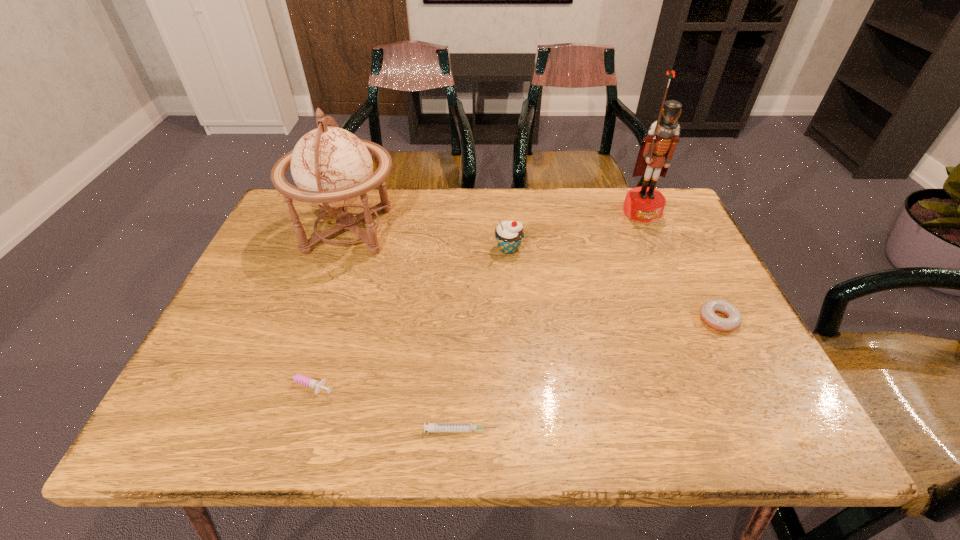
Identify the location of empty space that is in between the left syringe and the fourth farthest object. (511, 352).

This screenshot has height=540, width=960. I want to click on empty space between the fifth farthest object and the nutcracker, so click(x=472, y=298).

I want to click on object that is the second nearest to the fourth shortest object, so click(645, 204).

Identify the location of object that stands as the fifth closest to the nutcracker. (309, 382).

At what (x,y) coordinates should I click in order to perform the action: click on free spot that satisfies the following two spatial constraints: 1. at the front of the second tallest object showing Africa; 2. on the left side of the farther syringe. Please return your answer as a coordinate pair (x, y). The width and height of the screenshot is (960, 540). Looking at the image, I should click on (296, 385).

At what (x,y) coordinates should I click in order to perform the action: click on vacant point that satisfies the following two spatial constraints: 1. on the back side of the left syringe; 2. at the front of the globe showing Africa. Please return your answer as a coordinate pair (x, y). Looking at the image, I should click on (354, 231).

Find the location of `free space that satisfies the following two spatial constraints: 1. on the back side of the third nearest object; 2. at the front of the globe showing Africa`. free space that satisfies the following two spatial constraints: 1. on the back side of the third nearest object; 2. at the front of the globe showing Africa is located at coordinates (673, 231).

Locate an element on the screen. This screenshot has height=540, width=960. free location that satisfies the following two spatial constraints: 1. on the back side of the cupcake; 2. at the front of the second tallest object showing Africa is located at coordinates (507, 231).

The width and height of the screenshot is (960, 540). Identify the location of free location that satisfies the following two spatial constraints: 1. at the front of the fifth shortest object showing Africa; 2. on the left side of the third tallest object. (343, 249).

Where is `vacant area that satisfies the following two spatial constraints: 1. on the front-facing side of the nutcracker; 2. at the front of the second tallest object showing Africa`? Image resolution: width=960 pixels, height=540 pixels. vacant area that satisfies the following two spatial constraints: 1. on the front-facing side of the nutcracker; 2. at the front of the second tallest object showing Africa is located at coordinates (651, 231).